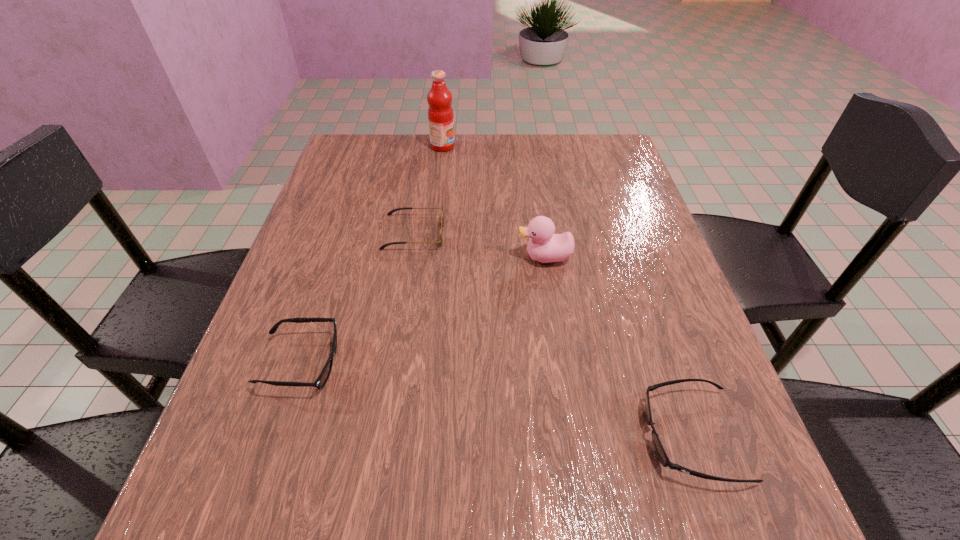
Image resolution: width=960 pixels, height=540 pixels. I want to click on the farthest object, so click(440, 112).

Locate an element on the screen. the tallest object is located at coordinates (440, 112).

You are a GUI agent. You are given a task and a screenshot of the screen. Output one action in this format:
    pyautogui.click(x=<x>, y=<y>)
    Task: Click on the duckling
    The width and height of the screenshot is (960, 540).
    Given the screenshot: What is the action you would take?
    pyautogui.click(x=544, y=246)

Where is `the fourth object from left to right`? The width and height of the screenshot is (960, 540). the fourth object from left to right is located at coordinates (544, 246).

Find the location of a particular element. Image resolution: width=960 pixels, height=540 pixels. the leftmost sunglasses is located at coordinates (322, 379).

At what (x,y) coordinates should I click in order to perform the action: click on the farthest sunglasses. Please return your answer as a coordinate pair (x, y). Looking at the image, I should click on pos(382,247).

Locate an element on the screen. The width and height of the screenshot is (960, 540). the rightmost sunglasses is located at coordinates (659, 450).

Where is `vacant space located on the front label of the farthest object`? This screenshot has width=960, height=540. vacant space located on the front label of the farthest object is located at coordinates (x=510, y=146).

Find the location of a particular element. blank space located 0.050m on the front-facing side of the fourth object from left to right is located at coordinates point(494,257).

This screenshot has height=540, width=960. What are the coordinates of `free point located on the front-facing side of the fourth object from left to right` in the screenshot? It's located at (462, 257).